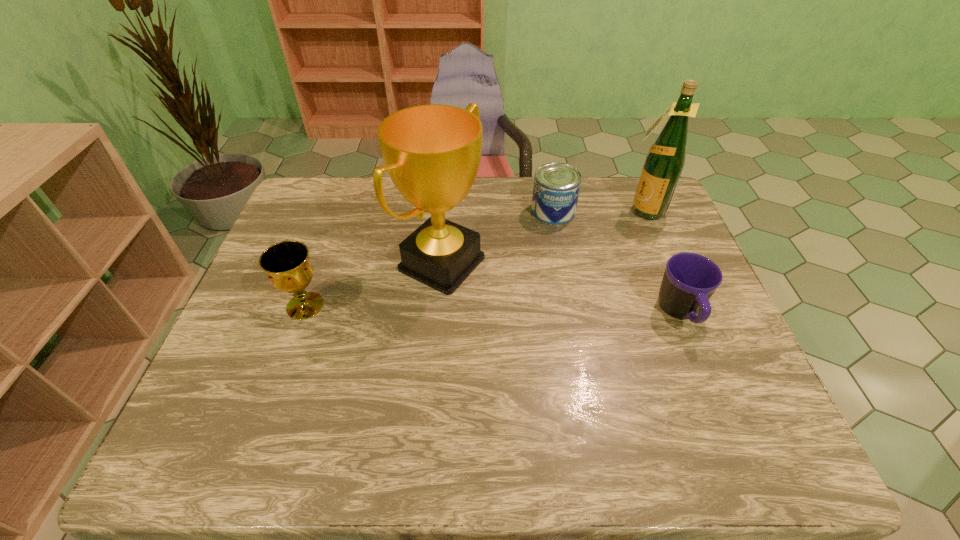
At what (x,y) coordinates should I click in order to perform the action: click on free space on the desktop that is between the third tallest object and the mug and is positioned on the front-facing side of the liquor. Please return your answer as a coordinate pair (x, y). The height and width of the screenshot is (540, 960). Looking at the image, I should click on (530, 310).

You are a GUI agent. You are given a task and a screenshot of the screen. Output one action in this format:
    pyautogui.click(x=<x>, y=<y>)
    Task: Click on the free space on the desktop that is between the third shortest object and the mug and is positioned on the front-facing side of the award
    The width and height of the screenshot is (960, 540).
    Given the screenshot: What is the action you would take?
    pyautogui.click(x=546, y=311)

Where is `vacant spot on the desktop that is between the chalice and the mug and is positioned on the front label of the third object from right to left`? vacant spot on the desktop that is between the chalice and the mug and is positioned on the front label of the third object from right to left is located at coordinates (510, 310).